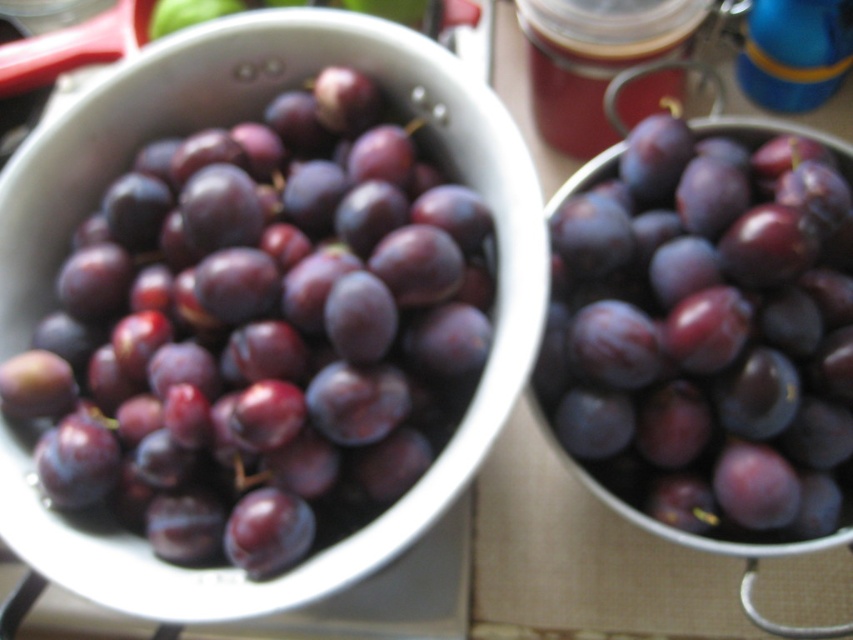
Question: Which point is closer to the camera?

Choices:
 (A) shiny purple grapes at left
 (B) shiny purple grapes at center

Answer: (A)

Question: Does shiny purple grapes at left have a lesser width compared to shiny purple grapes at center?

Choices:
 (A) yes
 (B) no

Answer: (B)

Question: Observing the image, what is the correct spatial positioning of shiny purple grapes at left in reference to shiny purple grapes at center?

Choices:
 (A) left
 (B) right

Answer: (A)

Question: Can you confirm if shiny purple grapes at left is wider than shiny purple grapes at center?

Choices:
 (A) no
 (B) yes

Answer: (B)